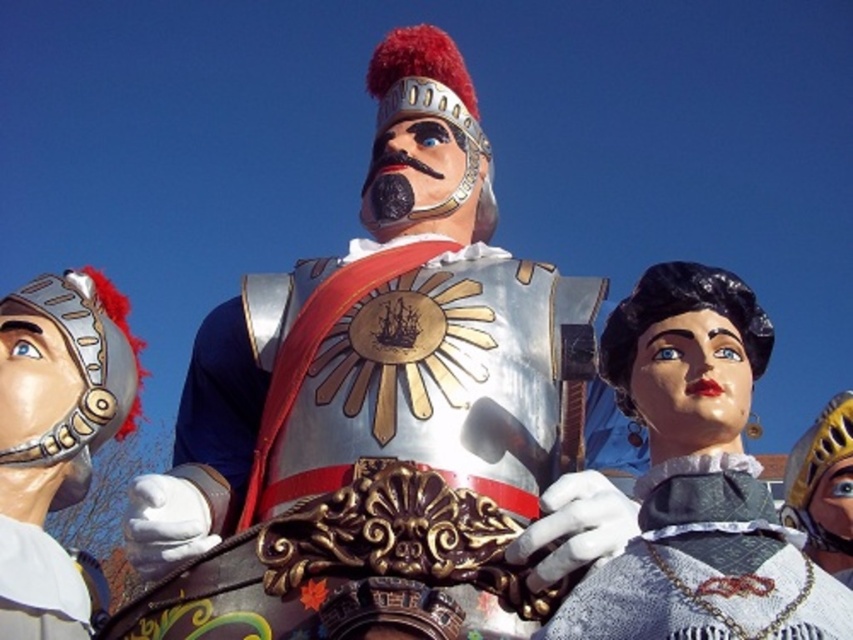
Question: Which point is closer to the camera?

Choices:
 (A) gold metallic helmet at right
 (B) smooth black wig at center
 (C) metallic helmet at left

Answer: (B)

Question: Where is smooth black wig at center located in relation to gold metallic helmet at right in the image?

Choices:
 (A) right
 (B) left

Answer: (B)

Question: Does smooth black wig at center appear over gold metallic helmet at right?

Choices:
 (A) yes
 (B) no

Answer: (A)

Question: Which of these objects is positioned farthest from the silver metallic chain at center?

Choices:
 (A) smooth black wig at center
 (B) metallic helmet at left

Answer: (B)

Question: Based on their relative distances, which object is nearer to the silver metallic chain at center?

Choices:
 (A) gold metallic helmet at right
 (B) metallic helmet at left
 (C) smooth black wig at center

Answer: (C)

Question: Does smooth black wig at center come behind silver metallic chain at center?

Choices:
 (A) no
 (B) yes

Answer: (B)